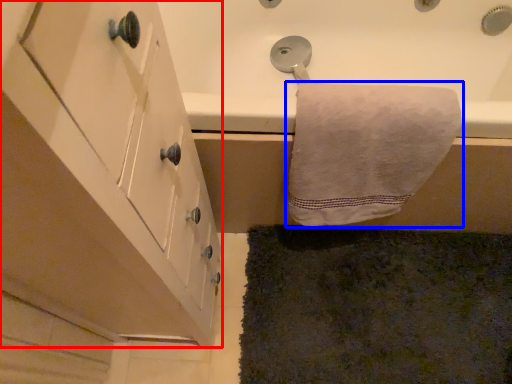
Question: Among these objects, which one is farthest to the camera, cabinetry (highlighted by a red box) or towel (highlighted by a blue box)?

Choices:
 (A) cabinetry
 (B) towel

Answer: (B)